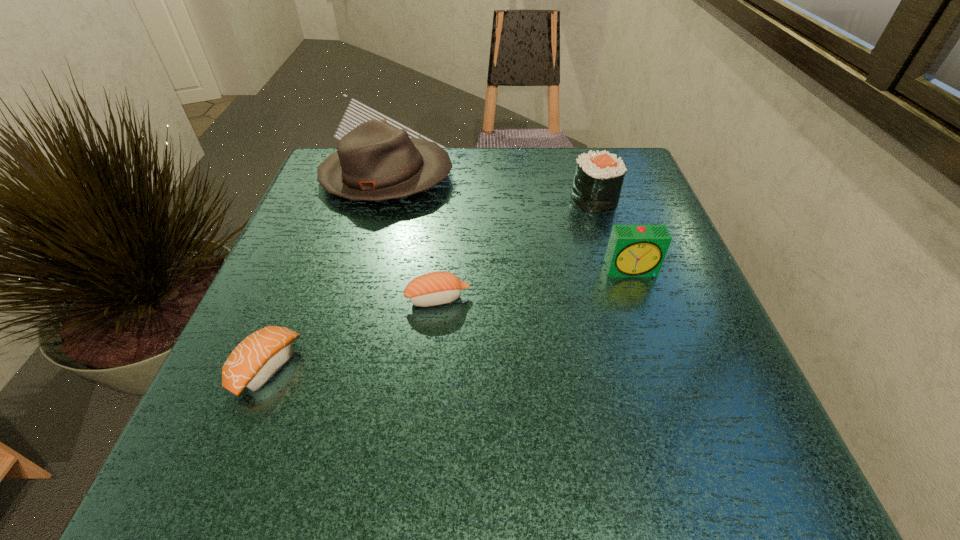
Locate which sushi ranks in proximity to the tallest sushi. Please provide its 2D coordinates. Your answer should be formatted as a tuple, i.e. [(x, y)], where the tuple contains the x and y coordinates of a point satisfying the conditions above.

[(436, 288)]

Point out which sushi is positioned as the third nearest to the alarm clock. Please provide its 2D coordinates. Your answer should be formatted as a tuple, i.e. [(x, y)], where the tuple contains the x and y coordinates of a point satisfying the conditions above.

[(255, 360)]

Find the location of a particular element. This screenshot has height=540, width=960. free point that satisfies the following two spatial constraints: 1. on the decorative side of the hat; 2. on the right side of the second farthest sushi is located at coordinates (353, 299).

Locate an element on the screen. vacant space that satisfies the following two spatial constraints: 1. on the decorative side of the hat; 2. on the front side of the nearest object is located at coordinates (335, 367).